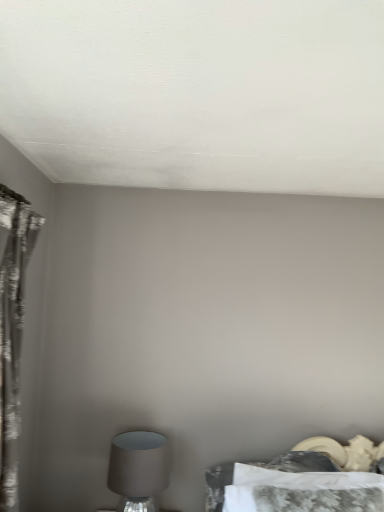
Question: Can you confirm if matte gray lampshade at lower left is bigger than silvery textured curtain at left?

Choices:
 (A) yes
 (B) no

Answer: (B)

Question: Considering the relative sizes of matte gray lampshade at lower left and silvery textured curtain at left in the image provided, is matte gray lampshade at lower left wider than silvery textured curtain at left?

Choices:
 (A) yes
 (B) no

Answer: (A)

Question: Is matte gray lampshade at lower left positioned with its back to silvery textured curtain at left?

Choices:
 (A) yes
 (B) no

Answer: (B)

Question: Does matte gray lampshade at lower left have a lesser width compared to silvery textured curtain at left?

Choices:
 (A) yes
 (B) no

Answer: (B)

Question: Does matte gray lampshade at lower left touch silvery textured curtain at left?

Choices:
 (A) yes
 (B) no

Answer: (B)

Question: Is matte gray lampshade at lower left aimed at silvery textured curtain at left?

Choices:
 (A) yes
 (B) no

Answer: (B)

Question: Does matte gray lampshade at lower left lie behind camouflage-patterned bed at lower right?

Choices:
 (A) yes
 (B) no

Answer: (A)

Question: Is matte gray lampshade at lower left shorter than camouflage-patterned bed at lower right?

Choices:
 (A) no
 (B) yes

Answer: (A)

Question: Does matte gray lampshade at lower left have a lesser width compared to camouflage-patterned bed at lower right?

Choices:
 (A) yes
 (B) no

Answer: (B)

Question: Would you say matte gray lampshade at lower left is outside camouflage-patterned bed at lower right?

Choices:
 (A) no
 (B) yes

Answer: (B)

Question: Is matte gray lampshade at lower left positioned with its back to camouflage-patterned bed at lower right?

Choices:
 (A) yes
 (B) no

Answer: (B)

Question: Does matte gray lampshade at lower left come in front of camouflage-patterned bed at lower right?

Choices:
 (A) yes
 (B) no

Answer: (B)

Question: Is camouflage-patterned bed at lower right further to camera compared to matte gray lampshade at lower left?

Choices:
 (A) yes
 (B) no

Answer: (B)